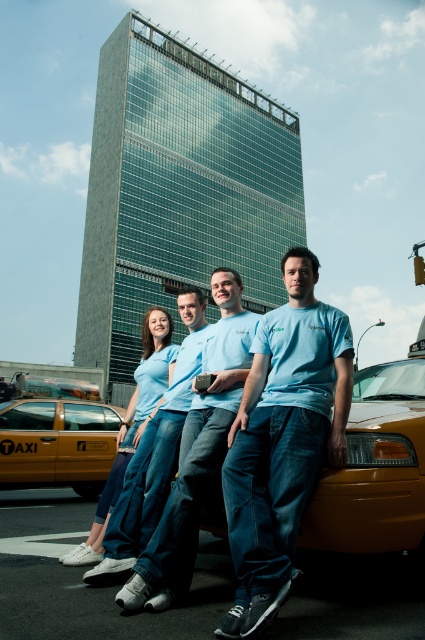
Question: Among these objects, which one is nearest to the camera?

Choices:
 (A) light blue cotton t-shirt at center
 (B) light blue denim jeans at center
 (C) light blue t-shirt at center

Answer: (A)

Question: Is matte yellow taxi cab at center positioned behind light blue t-shirt at center?

Choices:
 (A) no
 (B) yes

Answer: (A)

Question: Is light blue cotton t-shirt at center bigger than light blue denim jeans at center?

Choices:
 (A) yes
 (B) no

Answer: (B)

Question: Considering the real-world distances, which object is farthest from the light blue cotton t-shirt at center?

Choices:
 (A) light blue denim jeans at center
 (B) yellow taxi cab at lower left
 (C) light blue t-shirt at center
 (D) matte yellow taxi cab at center

Answer: (B)

Question: Which of the following is the closest to the observer?

Choices:
 (A) matte yellow taxi cab at center
 (B) light blue denim jeans at center
 (C) light blue cotton t-shirt at center
 (D) yellow taxi cab at lower left

Answer: (C)

Question: Can you confirm if matte yellow taxi cab at center is thinner than light blue denim jeans at center?

Choices:
 (A) no
 (B) yes

Answer: (B)